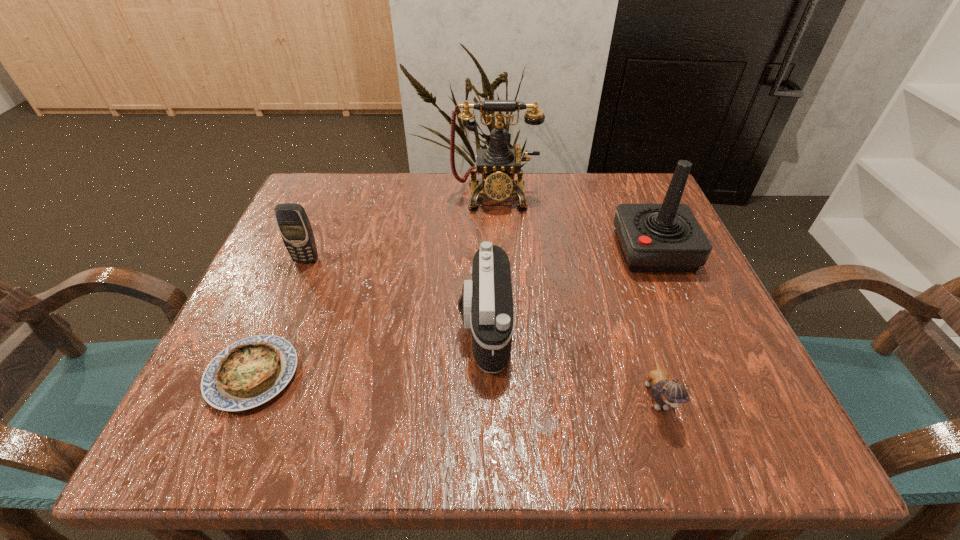
Image resolution: width=960 pixels, height=540 pixels. I want to click on free region at the far left corner, so click(x=359, y=176).

Image resolution: width=960 pixels, height=540 pixels. What are the coordinates of `free space at the near left corner of the desktop` in the screenshot? It's located at (269, 428).

Identify the location of free region at the far right corner of the desktop. Image resolution: width=960 pixels, height=540 pixels. (639, 173).

You are a GUI agent. You are given a task and a screenshot of the screen. Output one action in this format:
    pyautogui.click(x=<x>, y=<y>)
    Task: Click on the vacant space in between the fifth tallest object and the joystick
    The width and height of the screenshot is (960, 540).
    Given the screenshot: What is the action you would take?
    pyautogui.click(x=655, y=322)

The image size is (960, 540). Identify the location of free spot between the joystick and the second shortest object. (655, 322).

I want to click on vacant space that is in between the telephone and the cellular telephone, so click(400, 227).

Find the location of a particular element. This screenshot has height=540, width=960. vacant area that lies between the kitten and the quiche is located at coordinates (455, 384).

Locate an element on the screen. free space between the joystick and the kitten is located at coordinates (655, 322).

Locate an element on the screen. vacant region between the shortest object and the farthest object is located at coordinates (373, 285).

This screenshot has width=960, height=540. In order to click on vacant space that's between the camera and the cellular telephone in this screenshot , I will do `click(396, 293)`.